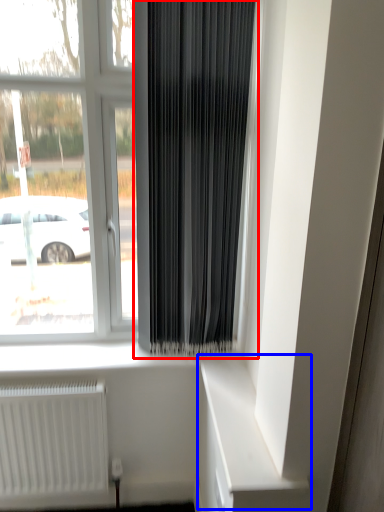
Question: Which object appears farthest to the camera in this image, curtain (highlighted by a red box) or shelf (highlighted by a blue box)?

Choices:
 (A) curtain
 (B) shelf

Answer: (A)